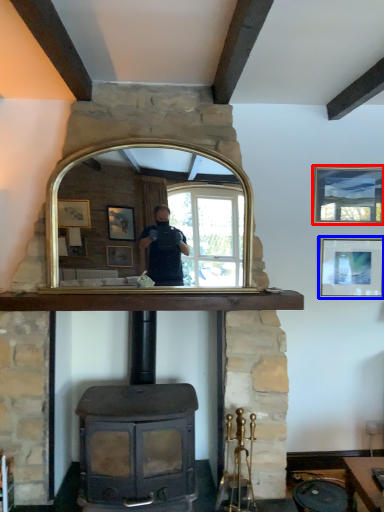
Question: Which object appears farthest to the camera in this image, picture frame (highlighted by a red box) or picture frame (highlighted by a blue box)?

Choices:
 (A) picture frame
 (B) picture frame

Answer: (B)